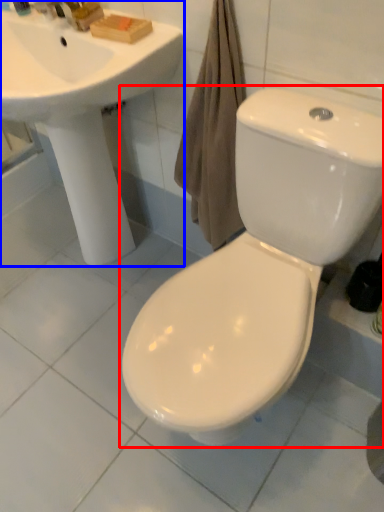
Question: Among these objects, which one is farthest to the camera, toilet (highlighted by a red box) or sink (highlighted by a blue box)?

Choices:
 (A) toilet
 (B) sink

Answer: (B)